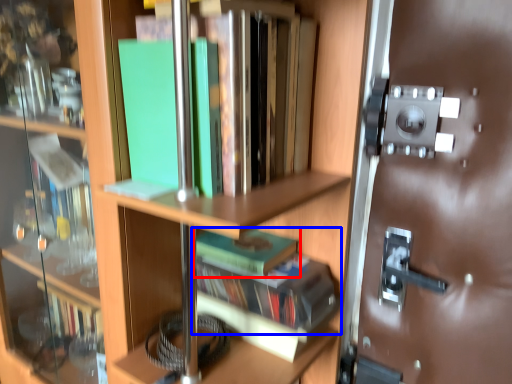
Question: Which of the following is the closest to the observer, book (highlighted by a red box) or book (highlighted by a blue box)?

Choices:
 (A) book
 (B) book

Answer: (B)